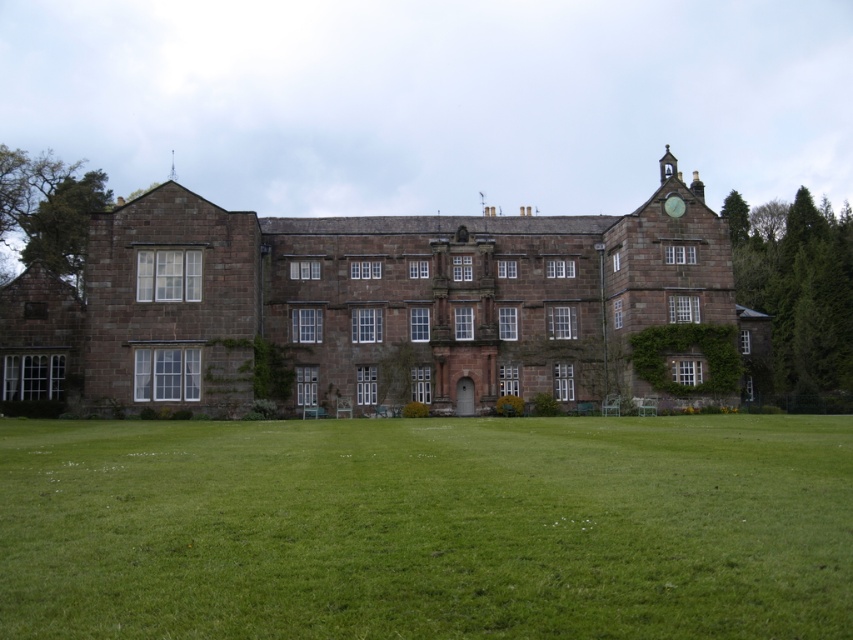
Question: In this image, where is green grass at lower center located relative to brown stone mansion at center?

Choices:
 (A) below
 (B) above

Answer: (A)

Question: Among these points, which one is farthest from the camera?

Choices:
 (A) (457, 333)
 (B) (440, 561)

Answer: (A)

Question: Which object appears farthest from the camera in this image?

Choices:
 (A) green grass at lower center
 (B) brown stone mansion at center

Answer: (B)

Question: Which point is farther to the camera?

Choices:
 (A) (x=848, y=560)
 (B) (x=415, y=394)

Answer: (B)

Question: Does green grass at lower center appear over brown stone mansion at center?

Choices:
 (A) no
 (B) yes

Answer: (A)

Question: Can you confirm if green grass at lower center is bigger than brown stone mansion at center?

Choices:
 (A) yes
 (B) no

Answer: (B)